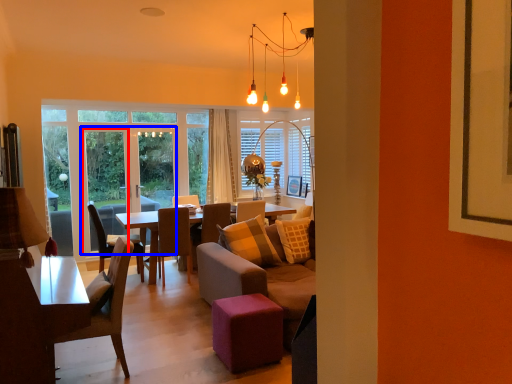
Question: Which of the following is the farthest to the observer, screen door (highlighted by a red box) or screen door (highlighted by a blue box)?

Choices:
 (A) screen door
 (B) screen door

Answer: (A)